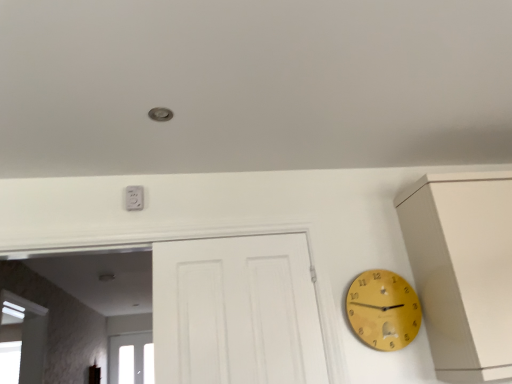
Question: Considering the positions of point (111, 372) and point (135, 193), is point (111, 372) closer or farther from the camera than point (135, 193)?

Choices:
 (A) farther
 (B) closer

Answer: (A)

Question: Looking at the image, does transparent glass window at lower left seem bigger or smaller compared to white plastic outlet at upper center?

Choices:
 (A) big
 (B) small

Answer: (A)

Question: Which is nearer to the yellow wooden clock at right?

Choices:
 (A) transparent glass window at lower left
 (B) white plastic outlet at upper center

Answer: (B)

Question: Estimate the real-world distances between objects in this image. Which object is closer to the transparent glass window at lower left?

Choices:
 (A) white plastic outlet at upper center
 (B) yellow wooden clock at right

Answer: (A)